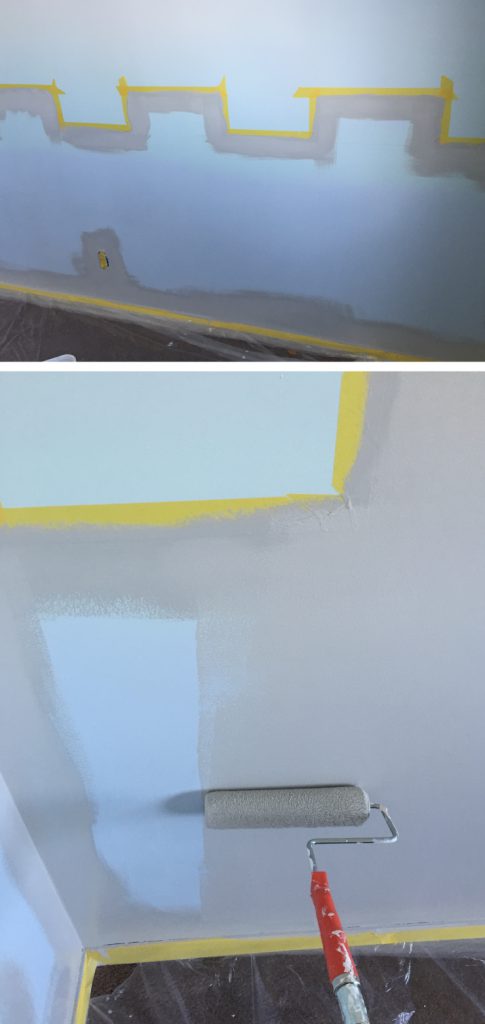
The image size is (485, 1024). In order to click on triangular area of bare brown carpeting in the corner in this screenshot , I will do `click(105, 975)`.